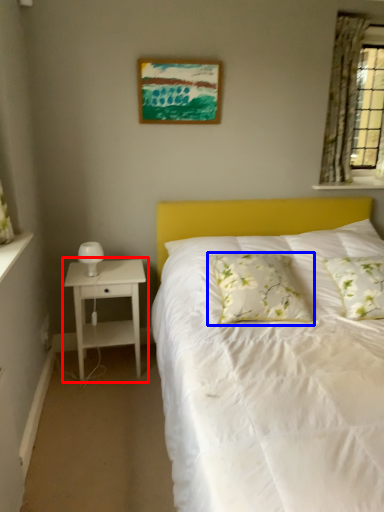
Question: Among these objects, which one is nearest to the camera, nightstand (highlighted by a red box) or pillow (highlighted by a blue box)?

Choices:
 (A) nightstand
 (B) pillow

Answer: (B)